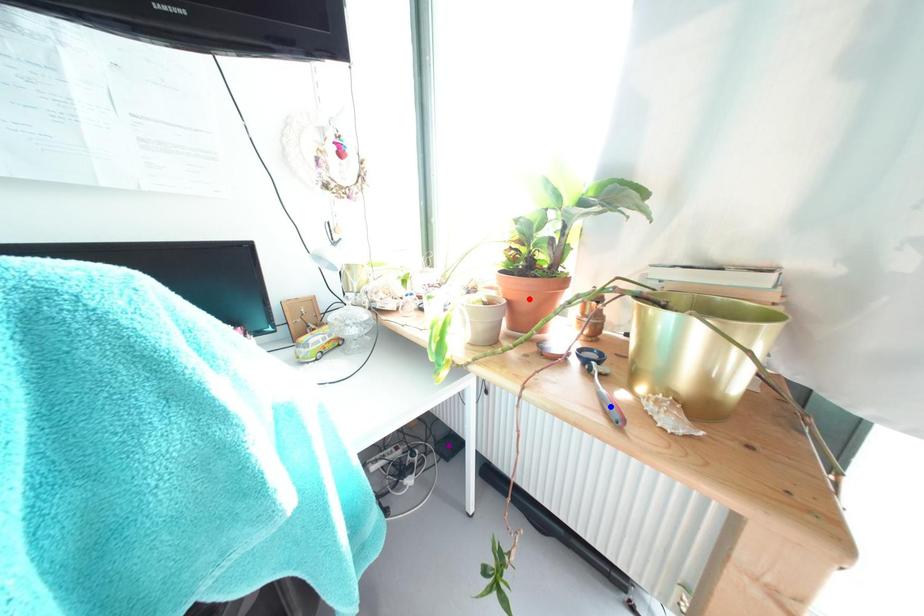
Order these from nearest to farthest:
- red point
- purple point
- blue point

purple point → red point → blue point